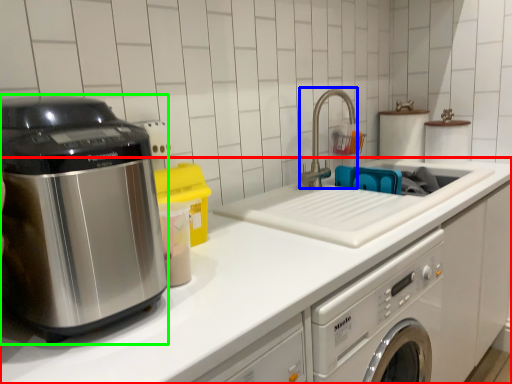
Question: Which object is positioned closest to countertop (highlighted by a red box)? Select from faucet (highlighted by a blue box) and home appliance (highlighted by a green box).

Choices:
 (A) faucet
 (B) home appliance

Answer: (B)